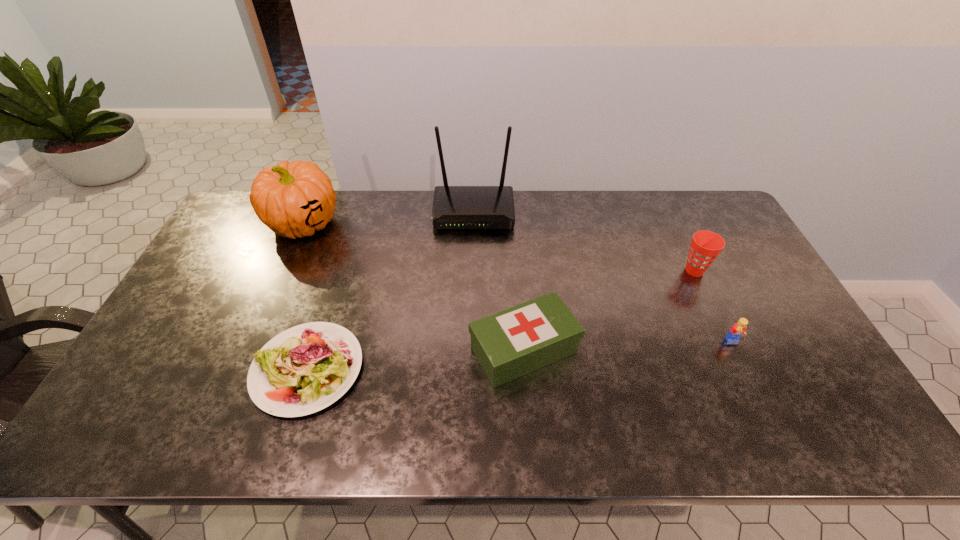
Identify the location of vacant region at the near edge of the desktop. (721, 411).

Locate an element on the screen. This screenshot has width=960, height=540. vacant space at the left edge of the desktop is located at coordinates (125, 399).

The image size is (960, 540). I want to click on vacant space at the right edge, so click(734, 273).

Image resolution: width=960 pixels, height=540 pixels. In the image, there is a desktop. In order to click on vacant region at the near left corner in this screenshot , I will do `click(156, 421)`.

Where is `vacant space at the far right corner`? The image size is (960, 540). vacant space at the far right corner is located at coordinates (675, 205).

What are the coordinates of `empty space between the first-aid kit and the shortest object` in the screenshot? It's located at (416, 360).

You are a GUI agent. You are given a task and a screenshot of the screen. Output one action in this format:
    pyautogui.click(x=<x>, y=<y>)
    Task: Click on the vacant area that lies between the pumpkin and the fourth shortest object
    Image resolution: width=960 pixels, height=540 pixels.
    Given the screenshot: What is the action you would take?
    pyautogui.click(x=499, y=247)

The image size is (960, 540). Identify the location of unoccupied position between the salad plate and the router. (391, 291).

The image size is (960, 540). What are the coordinates of `vacant point located between the second shortest object and the first-aid kit` in the screenshot? It's located at (629, 346).

This screenshot has width=960, height=540. In order to click on vacant space in between the first-aid kit and the Lego in this screenshot , I will do `click(629, 346)`.